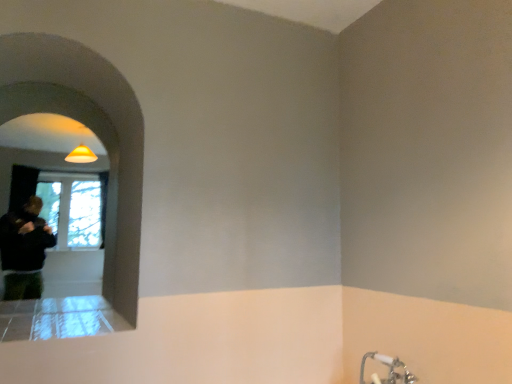
Question: Is the position of silver metallic faucet at lower right less distant than that of white smooth archway at upper left?

Choices:
 (A) no
 (B) yes

Answer: (A)

Question: Considering the relative sizes of silver metallic faucet at lower right and white smooth archway at upper left in the image provided, is silver metallic faucet at lower right thinner than white smooth archway at upper left?

Choices:
 (A) yes
 (B) no

Answer: (A)

Question: Would you say silver metallic faucet at lower right is a long distance from white smooth archway at upper left?

Choices:
 (A) no
 (B) yes

Answer: (B)

Question: From a real-world perspective, is silver metallic faucet at lower right beneath white smooth archway at upper left?

Choices:
 (A) yes
 (B) no

Answer: (A)

Question: Can you confirm if silver metallic faucet at lower right is wider than white smooth archway at upper left?

Choices:
 (A) yes
 (B) no

Answer: (B)

Question: Is silver metallic faucet at lower right turned away from white smooth archway at upper left?

Choices:
 (A) yes
 (B) no

Answer: (B)

Question: Is silver metallic faucet at lower right inside white smooth archway at upper left?

Choices:
 (A) no
 (B) yes

Answer: (A)

Question: Is white smooth archway at upper left closer to camera compared to silver metallic faucet at lower right?

Choices:
 (A) yes
 (B) no

Answer: (A)

Question: Is white smooth archway at upper left positioned far away from silver metallic faucet at lower right?

Choices:
 (A) no
 (B) yes

Answer: (B)

Question: Is white smooth archway at upper left further to camera compared to silver metallic faucet at lower right?

Choices:
 (A) no
 (B) yes

Answer: (A)

Question: Considering the relative sizes of white smooth archway at upper left and silver metallic faucet at lower right in the image provided, is white smooth archway at upper left taller than silver metallic faucet at lower right?

Choices:
 (A) yes
 (B) no

Answer: (A)

Question: From the image's perspective, is white smooth archway at upper left beneath silver metallic faucet at lower right?

Choices:
 (A) no
 (B) yes

Answer: (A)

Question: Considering the positions of silver metallic faucet at lower right and white smooth archway at upper left in the image, is silver metallic faucet at lower right bigger or smaller than white smooth archway at upper left?

Choices:
 (A) big
 (B) small

Answer: (B)